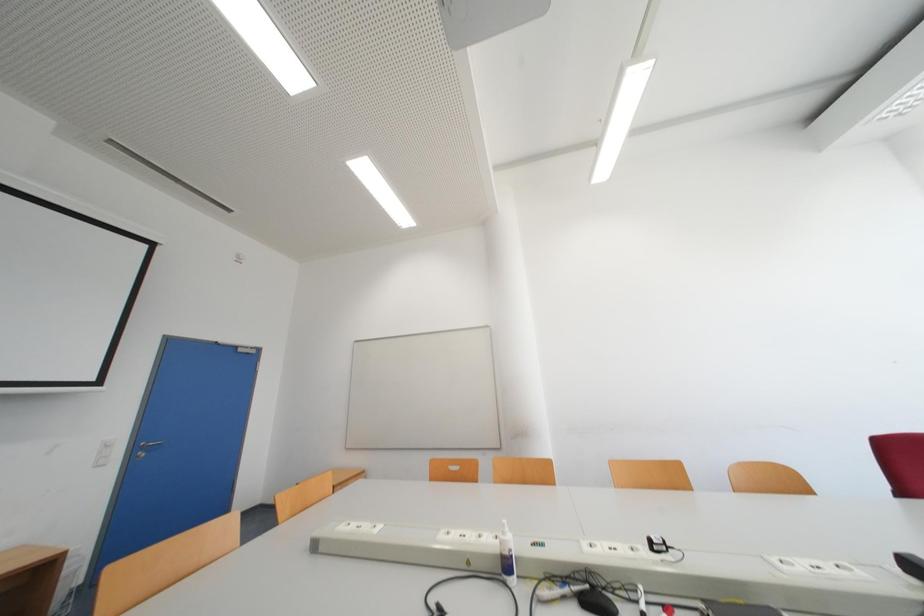
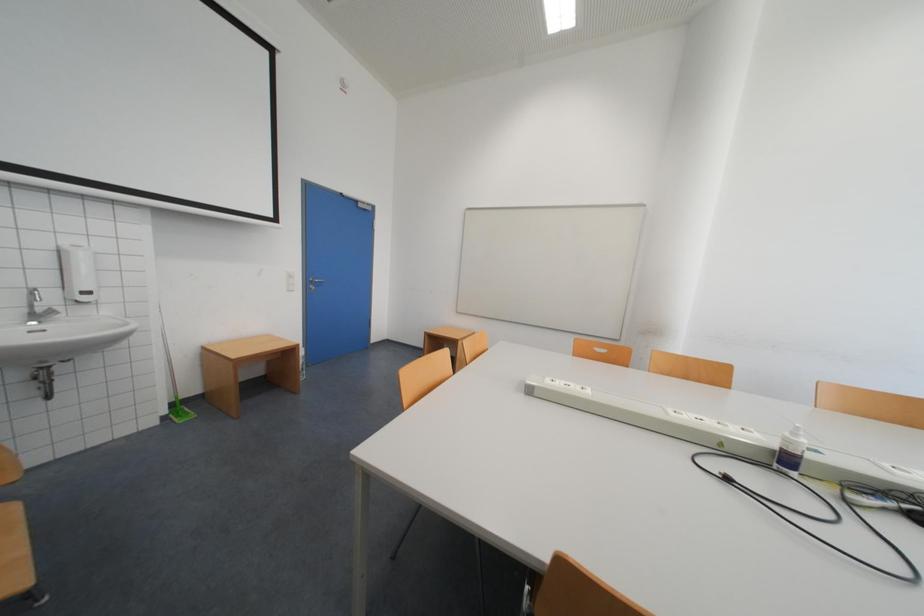
Question: What movement of the cameraman would produce the second image?

Choices:
 (A) Left
 (B) Right
 (C) Forward
 (D) Backward

Answer: (A)